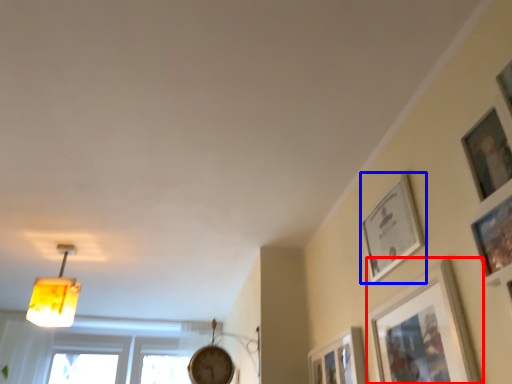
Question: Which object appears closest to the camera in this image, picture frame (highlighted by a red box) or picture frame (highlighted by a blue box)?

Choices:
 (A) picture frame
 (B) picture frame

Answer: (A)